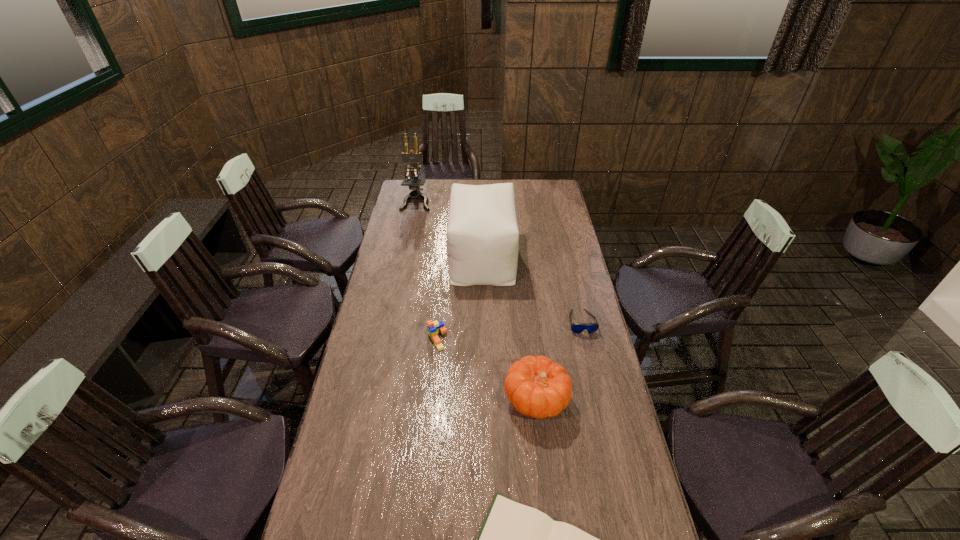
Identify the location of the farthest object. coord(413,157).

The image size is (960, 540). I want to click on the tallest object, so click(413, 157).

Find the location of a particular element. The height and width of the screenshot is (540, 960). the second tallest object is located at coordinates (482, 233).

At what (x,y) coordinates should I click in order to perform the action: click on the second farthest object. Please return your answer as a coordinate pair (x, y). The image size is (960, 540). Looking at the image, I should click on (482, 233).

Identify the location of pumpkin. (537, 387).

Identify the location of the second nearest object. (537, 387).

I want to click on Lego, so click(x=434, y=327).

You are a GUI agent. You are given a task and a screenshot of the screen. Output one action in this format:
    pyautogui.click(x=<x>, y=<y>)
    Task: Click on the sunglasses
    This screenshot has height=540, width=960.
    Given the screenshot: What is the action you would take?
    pyautogui.click(x=577, y=328)

This screenshot has height=540, width=960. In order to click on vacant area situated at the eyepieces of the microscope in this screenshot , I will do `click(409, 238)`.

In order to click on vacant space situated 0.200m on the side of the second tallest object with the smiley face in this screenshot , I will do `click(406, 257)`.